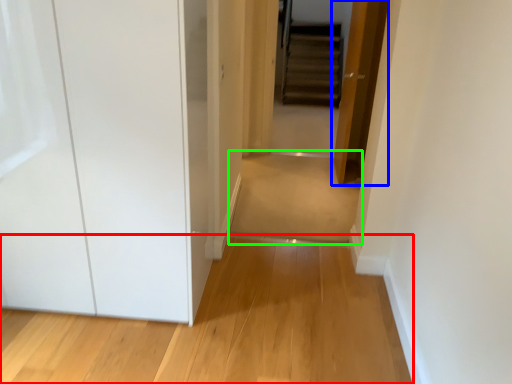
Question: Considering the real-world distances, which object is closest to path (highlighted by a red box)? door (highlighted by a blue box) or path (highlighted by a green box).

Choices:
 (A) door
 (B) path

Answer: (B)